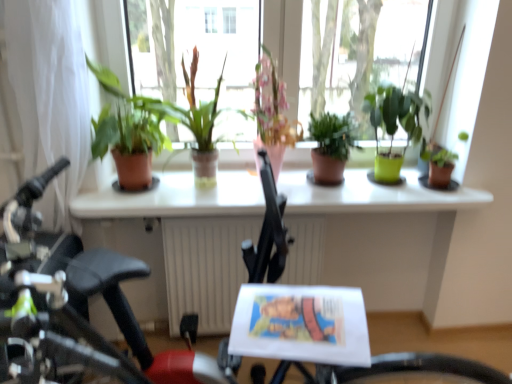
The width and height of the screenshot is (512, 384). What are the coordinates of `free point below green matte plant at center, which ranks as the fifth houseplant in left-to-right order (from a real-world perspective)` in the screenshot? It's located at (389, 180).